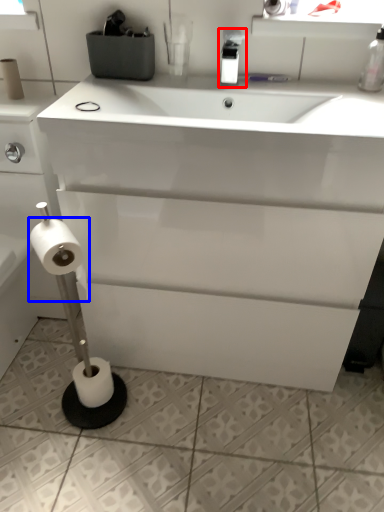
Question: Which of the following is the closest to the observer, bottle (highlighted by a red box) or toilet paper (highlighted by a blue box)?

Choices:
 (A) bottle
 (B) toilet paper

Answer: (B)